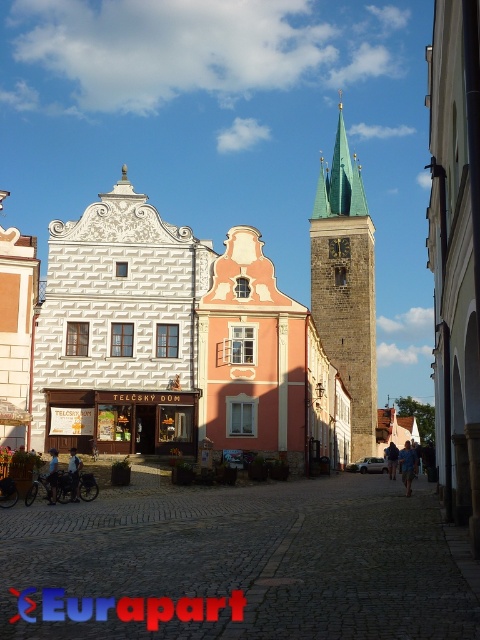
Question: Is stone tower at center positioned behind gold textured clock at center?

Choices:
 (A) yes
 (B) no

Answer: (B)

Question: Does stone tower at center appear on the left side of gold textured clock at center?

Choices:
 (A) yes
 (B) no

Answer: (B)

Question: Can you confirm if stone tower at center is positioned below gold textured clock at center?

Choices:
 (A) yes
 (B) no

Answer: (B)